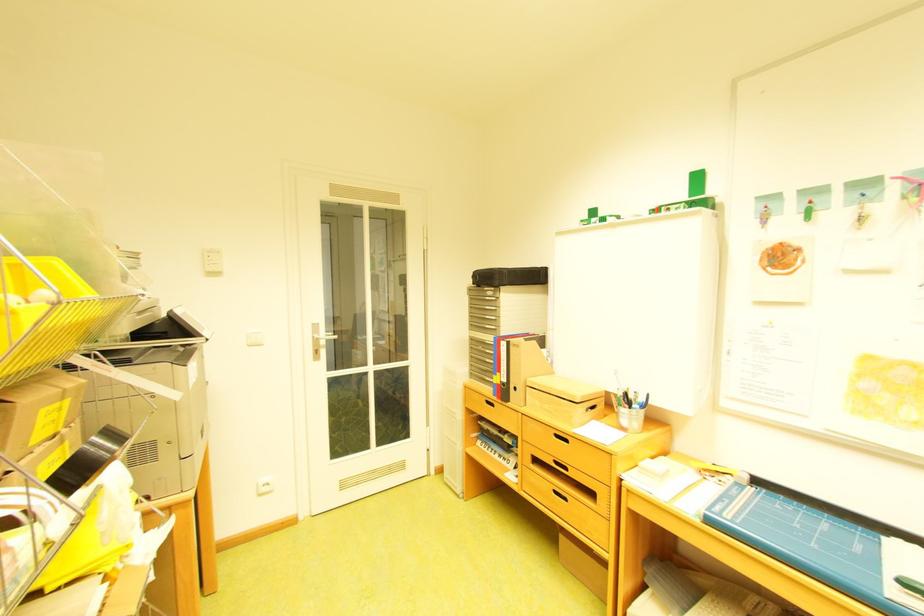
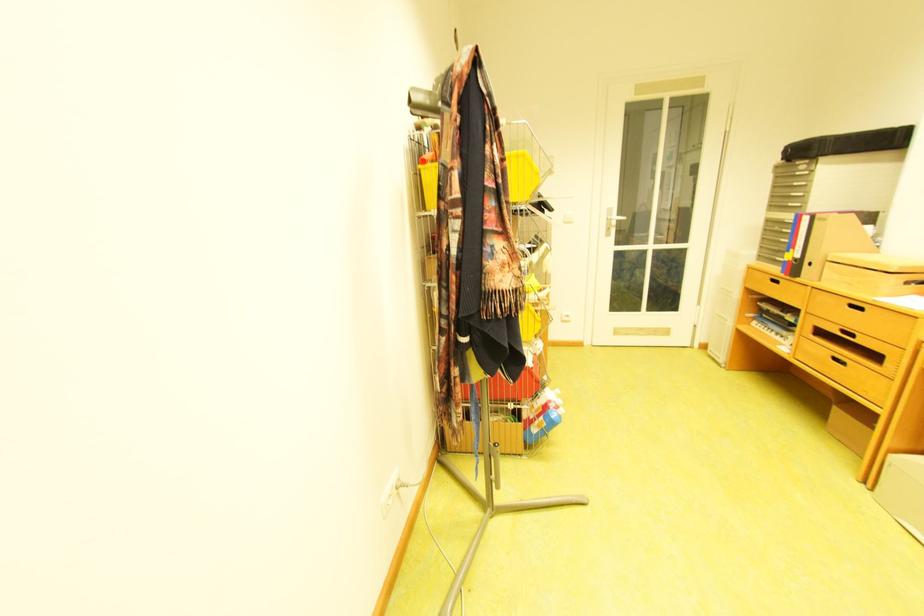
The point at (568,437) is marked in the first image. Where is the corresponding point in the second image?

(862, 307)